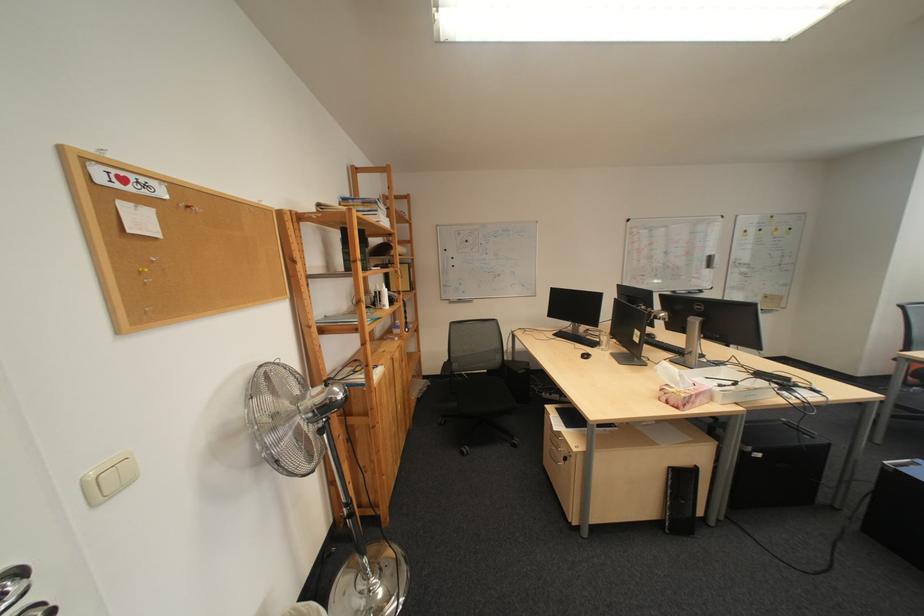
The height and width of the screenshot is (616, 924). Find the location of `black chair sitting surface`. black chair sitting surface is located at coordinates (485, 392).